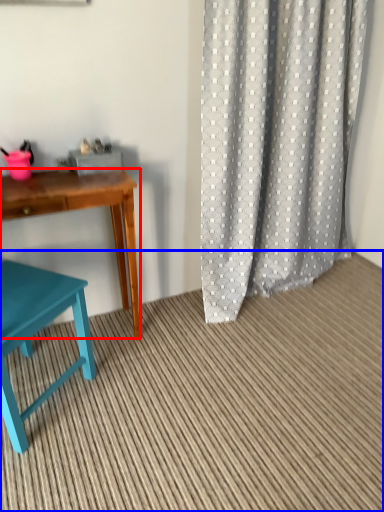
Question: Among these objects, which one is farthest to the camera, desk (highlighted by a red box) or plain (highlighted by a blue box)?

Choices:
 (A) desk
 (B) plain

Answer: (A)